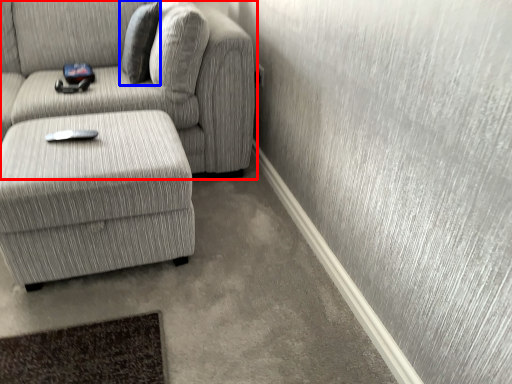
Question: Which object is closer to the camera taking this photo, studio couch (highlighted by a red box) or pillow (highlighted by a blue box)?

Choices:
 (A) studio couch
 (B) pillow

Answer: (A)